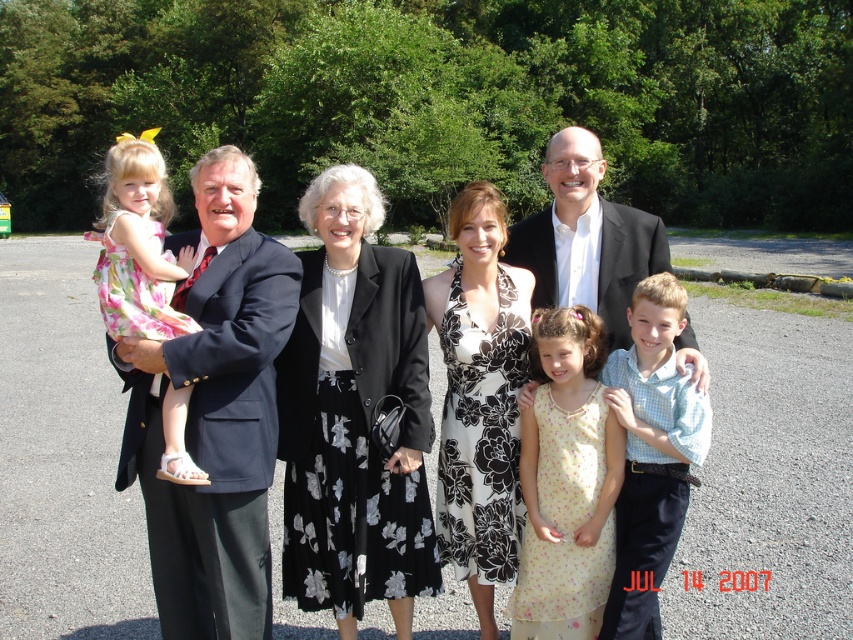
You are standing at the origin point in the image. Which direction should you move to reach the black floral skirt at center?

The black floral skirt at center is located at coordinates 0.650 on the x axis and 0.416 on the y axis, so you should move northeast to reach it.

You are a photographer at the event and want to capture a photo of the black floral skirt at center and the yellow floral dress at center. Which one is on the left side?

The black floral skirt at center is positioned on the left side of the yellow floral dress at center.